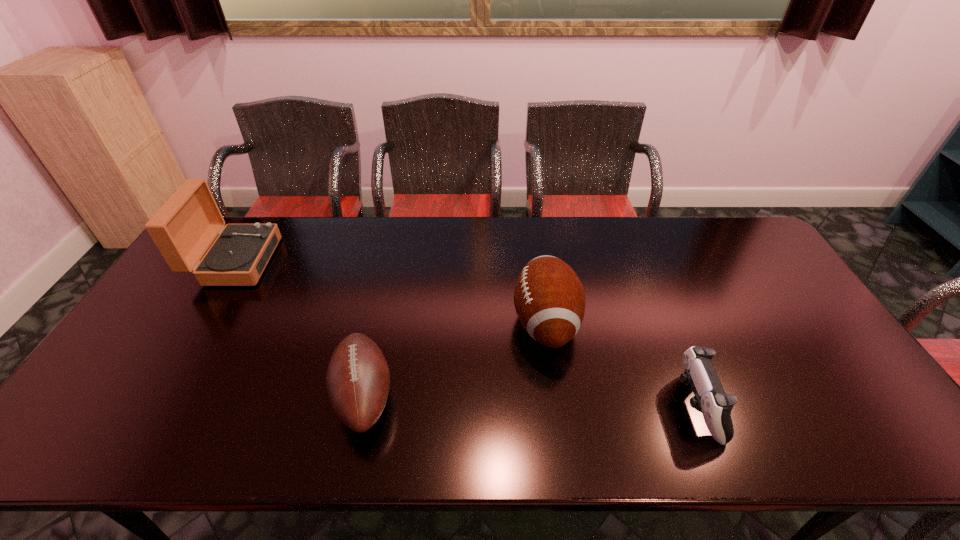
Identify the location of free space located on the laces of the taller football (American). (456, 322).

Find the location of a particular element. The image size is (960, 540). vacant area located on the left of the shorter football (American) is located at coordinates (309, 396).

Identify the location of vacant position located 0.340m on the front-facing side of the control. Image resolution: width=960 pixels, height=540 pixels. (537, 406).

Find the location of a particular element. vacant space located on the front-facing side of the control is located at coordinates tap(608, 406).

Where is `vacant position located on the front-facing side of the control`? Image resolution: width=960 pixels, height=540 pixels. vacant position located on the front-facing side of the control is located at coordinates (512, 406).

In order to click on object that is at the far edge in this screenshot , I will do `click(185, 226)`.

Find the location of a particular element. football (American) positioned at the near edge is located at coordinates (358, 379).

Find the location of a particular element. The image size is (960, 540). control at the near edge is located at coordinates (710, 399).

You are a GUI agent. You are given a task and a screenshot of the screen. Output one action in this format:
    pyautogui.click(x=<x>, y=<y>)
    Task: Click on the object situated at the left edge
    
    Given the screenshot: What is the action you would take?
    pyautogui.click(x=185, y=226)

Where is `object situated at the far left corner`? The image size is (960, 540). object situated at the far left corner is located at coordinates (185, 226).